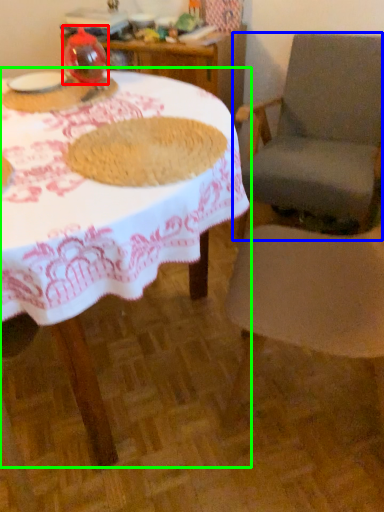
Question: Considering the real-world distances, which object is farthest from tableware (highlighted by a red box)? chair (highlighted by a blue box) or table (highlighted by a green box)?

Choices:
 (A) chair
 (B) table

Answer: (A)